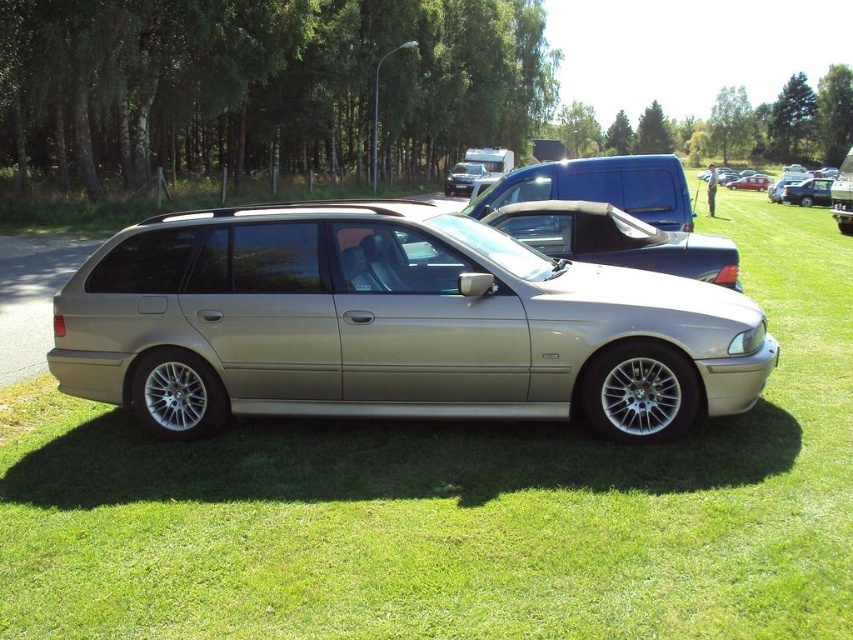
You are a parking attendant who needs to fit both the satin silver car at center and the metallic silver sedan at center into a parking space that is 5 meters long. Given their sizes, will both vehicles fit side by side in the space?

The satin silver car at center is smaller than the metallic silver sedan at center. However, without knowing their exact combined length, it is impossible to determine if they fit into a 5 meter space. Additional information about each vehicle length is required.